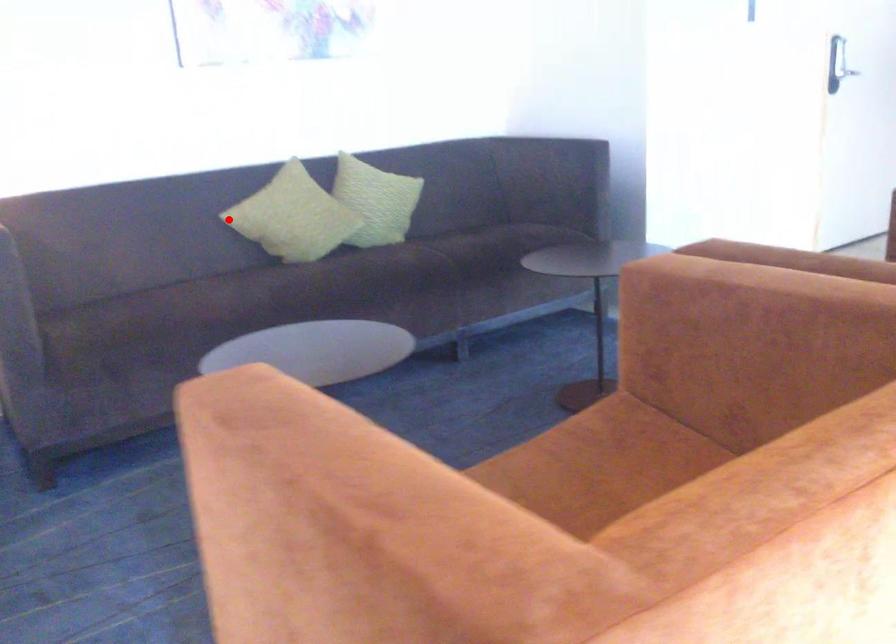
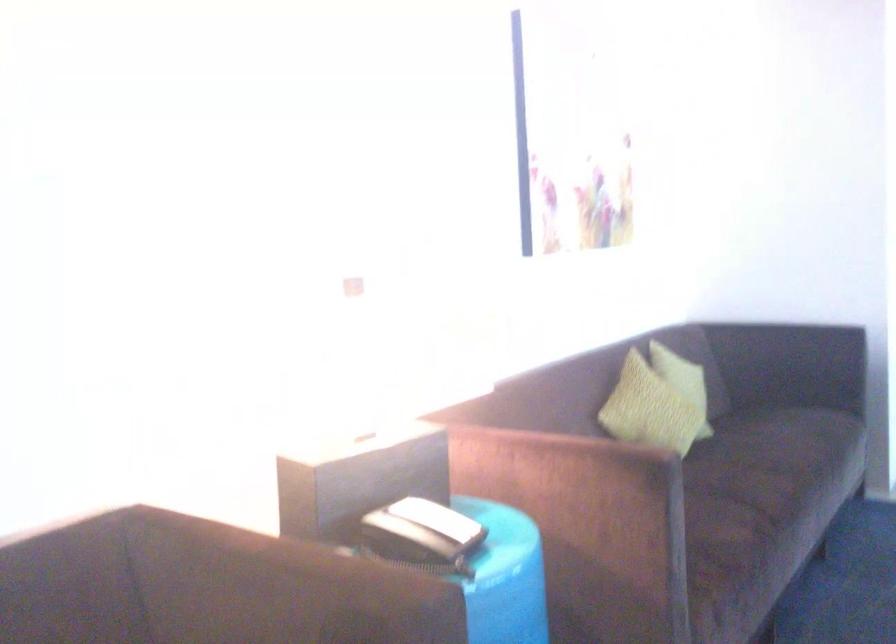
Question: I am providing you with two images of the same scene from different viewpoints. Image1 has a red point marked. In image2, the corresponding 3D location appears at what relative position? Reply with the corresponding letter.

Choices:
 (A) Closer
 (B) Farther

Answer: (A)